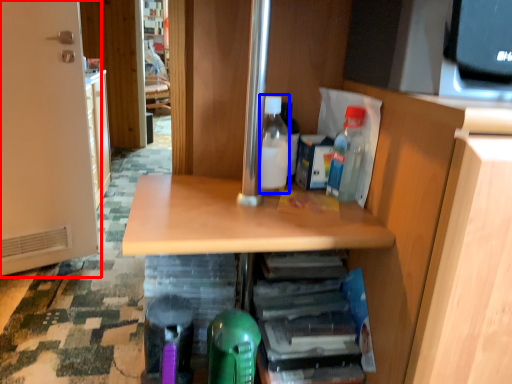
Question: Which point is further to the camera, door (highlighted by a red box) or bottle (highlighted by a blue box)?

Choices:
 (A) door
 (B) bottle

Answer: (A)